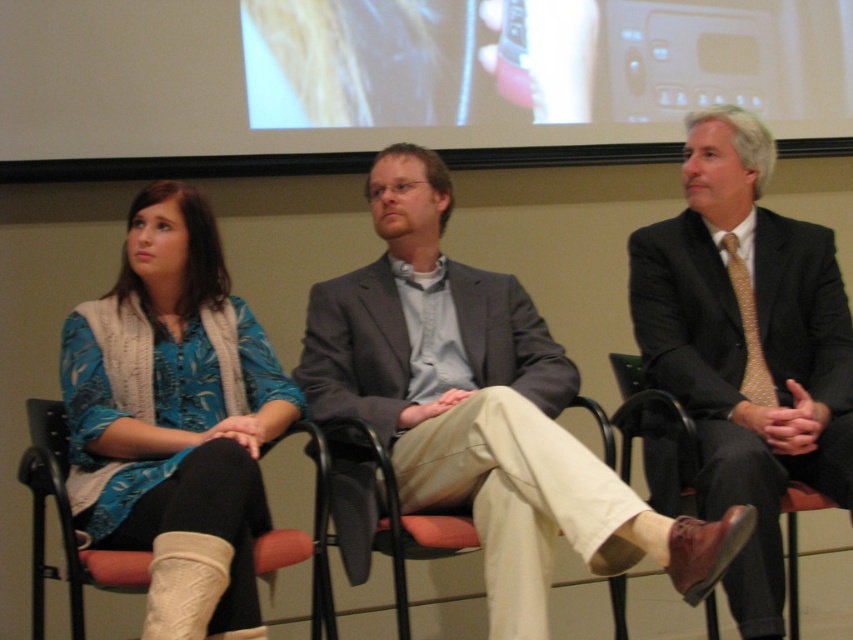
Question: Is gray suit at center to the left of polished dark suit at center from the viewer's perspective?

Choices:
 (A) no
 (B) yes

Answer: (B)

Question: Is fabric cushioned chair at lower left wider than light brown leather chair at center?

Choices:
 (A) no
 (B) yes

Answer: (B)

Question: Can you confirm if gray suit at center is bigger than polished dark suit at center?

Choices:
 (A) no
 (B) yes

Answer: (B)

Question: Which object is positioned farthest from the knit sweater at left?

Choices:
 (A) polished dark suit at center
 (B) fabric cushioned chair at lower left

Answer: (A)

Question: Estimate the real-world distances between objects in this image. Which object is farther from the polished dark suit at center?

Choices:
 (A) light brown leather chair at center
 (B) fabric cushioned chair at lower left

Answer: (B)

Question: Which point appears closest to the camera in this image?

Choices:
 (A) (198, 212)
 (B) (463, 532)

Answer: (B)